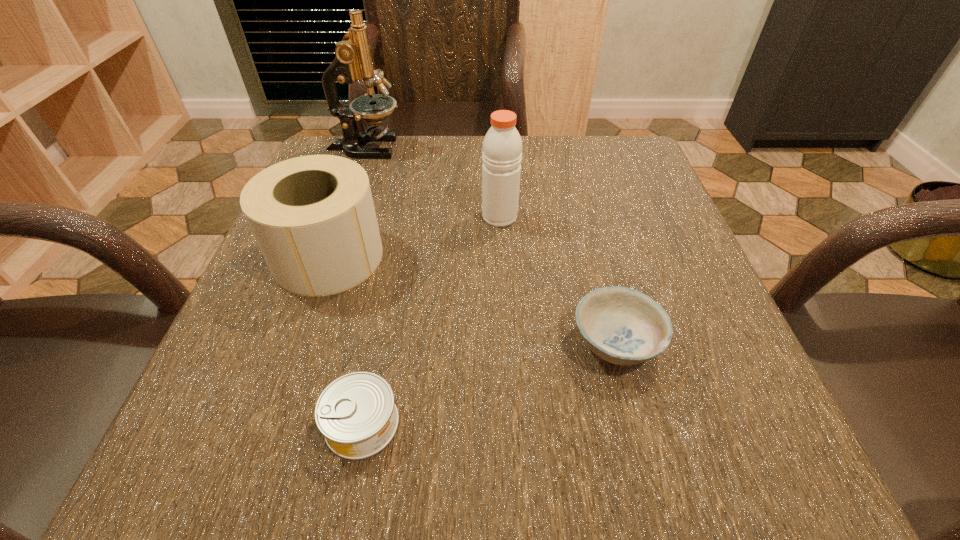
Find the location of a particular element. This screenshot has height=540, width=960. vacant area that lies between the can and the third tallest object is located at coordinates (346, 340).

You are a GUI agent. You are given a task and a screenshot of the screen. Output one action in this format:
    pyautogui.click(x=<x>, y=<y>)
    Task: Click on the blank region between the second object from right to left and the can
    
    Given the screenshot: What is the action you would take?
    pyautogui.click(x=431, y=320)

Locate an element on the screen. This screenshot has height=540, width=960. vacant space that is in between the rightmost object and the farthest object is located at coordinates (491, 245).

Identify the location of vacant space that is in between the can and the farthest object. (364, 286).

Locate an element on the screen. This screenshot has width=960, height=540. object that can be found as the third closest to the tallest object is located at coordinates pos(623,326).

You are a GUI agent. You are given a task and a screenshot of the screen. Output one action in this format:
    pyautogui.click(x=<x>, y=<y>)
    Task: Click on the closest object to the toilet tissue
    The height and width of the screenshot is (540, 960).
    Given the screenshot: What is the action you would take?
    pyautogui.click(x=356, y=413)

Locate an element on the screen. The width and height of the screenshot is (960, 540). free space in the image that satisfies the following two spatial constraints: 1. on the back side of the bowl; 2. at the eyepiece of the farthest object is located at coordinates (565, 148).

You are a GUI agent. You are given a task and a screenshot of the screen. Output one action in this format:
    pyautogui.click(x=<x>, y=<y>)
    Task: Click on the blank space that satisfies the following two spatial constraints: 1. on the back side of the can; 2. on the left side of the shaker
    
    Given the screenshot: What is the action you would take?
    pyautogui.click(x=402, y=217)

Locate an element on the screen. The height and width of the screenshot is (540, 960). free space that satisfies the following two spatial constraints: 1. on the back side of the third tallest object; 2. at the eyepiece of the tallest object is located at coordinates (366, 148).

Where is `free spot that satisfies the following two spatial constraints: 1. on the back side of the can; 2. on the left side of the shaker`? free spot that satisfies the following two spatial constraints: 1. on the back side of the can; 2. on the left side of the shaker is located at coordinates click(x=402, y=217).